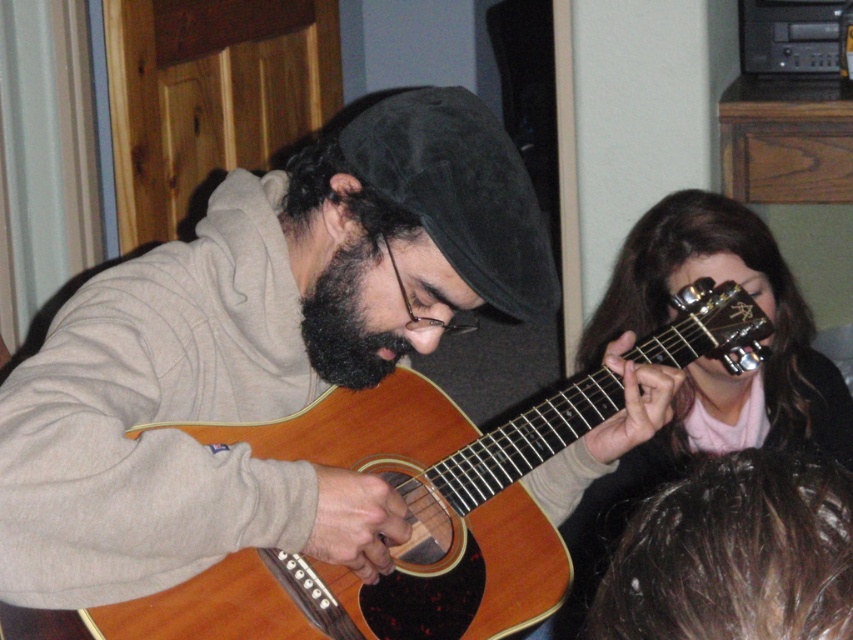
You are a photographer trying to capture a closeup of the wooden acoustic guitar at center and dark brown fuzzy beard at center in the scene. Which object is wider so that it can fit better in the frame?

The wooden acoustic guitar at center is wider than the dark brown fuzzy beard at center, so it can fit better in the frame.

Based on the scene description, which object is taller between the wooden acoustic guitar at center and the dark brown fuzzy beard at center?

The wooden acoustic guitar at center is taller than the dark brown fuzzy beard at center.